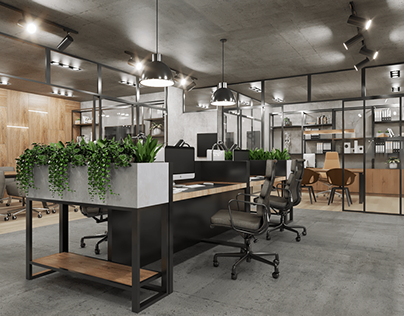
Image resolution: width=404 pixels, height=316 pixels. What are the coordinates of `chairs` in the screenshot? It's located at (246, 219), (276, 198), (99, 215), (16, 189), (54, 206), (339, 174), (309, 179).